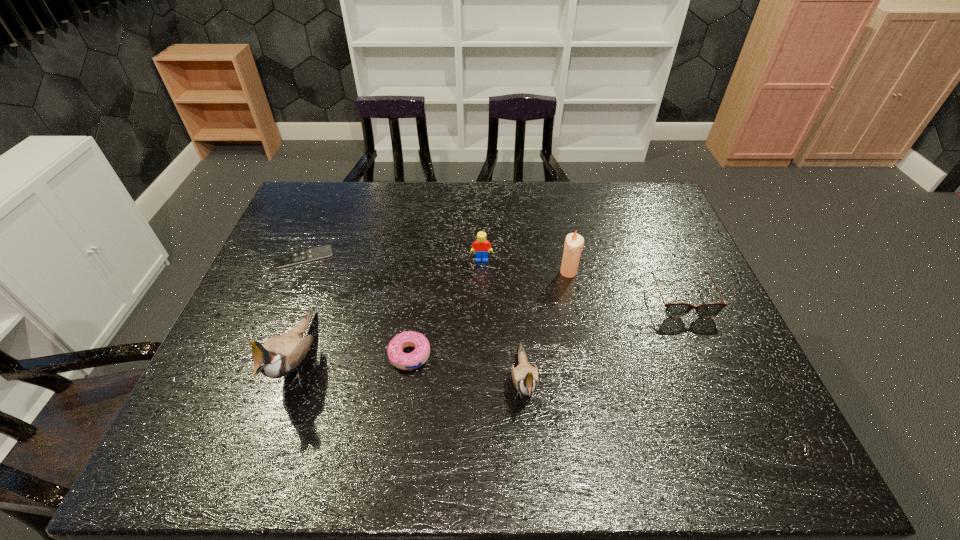
Find the location of a particular element. The height and width of the screenshot is (540, 960). the taller bird is located at coordinates (279, 355).

You are a GUI agent. You are given a task and a screenshot of the screen. Output one action in this format:
    pyautogui.click(x=<x>, y=<y>)
    Task: Click on the left bird
    The image size is (960, 540).
    Given the screenshot: What is the action you would take?
    pyautogui.click(x=279, y=355)

Find the location of `the right bird`. the right bird is located at coordinates (525, 378).

Identify the location of the third object from right to left. The height and width of the screenshot is (540, 960). (525, 378).

Where is `the fourth object from right to left`? The image size is (960, 540). the fourth object from right to left is located at coordinates (x=480, y=246).

Find the location of a particular element. Image resolution: width=960 pixels, height=540 pixels. Lego is located at coordinates (480, 246).

Where is `candle`? The image size is (960, 540). candle is located at coordinates (574, 243).

This screenshot has height=540, width=960. What are the coordinates of `spectacles` in the screenshot? It's located at (675, 310).

Identify the location of the rightmost object. This screenshot has width=960, height=540. (675, 310).

What are the coordinates of `remote control` in the screenshot? It's located at (321, 252).